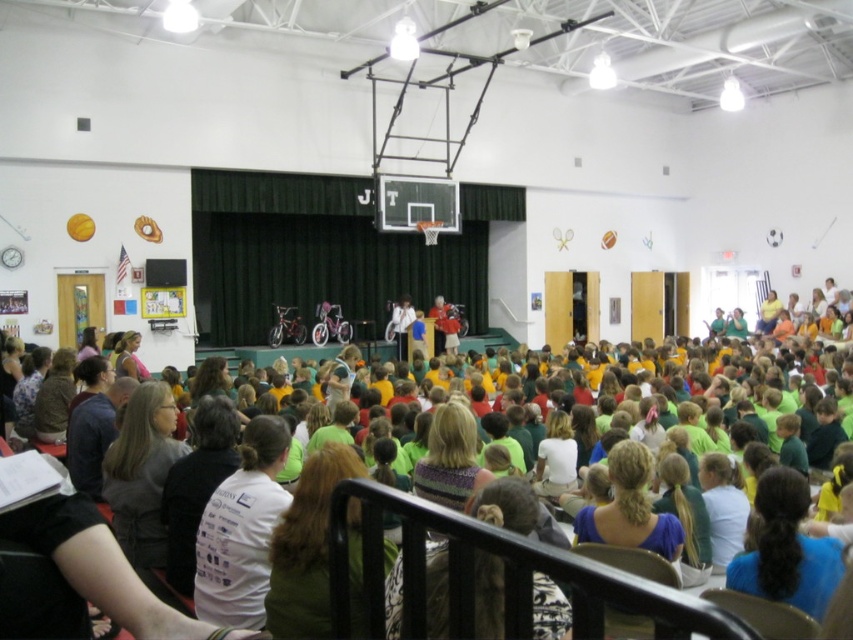
This screenshot has height=640, width=853. I want to click on gray fabric at lower left, so click(141, 472).

Does point (136, 561) lie in front of point (740, 579)?

No, (136, 561) is behind (740, 579).

This screenshot has width=853, height=640. I want to click on gray fabric at lower left, so click(x=141, y=472).

Between point (315, 589) and point (126, 492), which one is positioned behind?

The point (126, 492) is behind.

Who is higher up, green fabric shirt at lower center or gray fabric at lower left?

green fabric shirt at lower center

Is point (276, 621) in front of point (160, 458)?

Yes, it is in front of point (160, 458).

Where is `green fabric shirt at lower center`? Image resolution: width=853 pixels, height=640 pixels. green fabric shirt at lower center is located at coordinates (306, 547).

Does white matte shirt at lower center appear over green fabric shirt at lower center?

Incorrect, white matte shirt at lower center is not positioned above green fabric shirt at lower center.

Is point (233, 481) less distant than point (350, 548)?

No, it is not.

Measure the distance between point (x=280, y=420) and camera.

12.20 feet

Identify the location of white matte shirt at lower center. (242, 529).